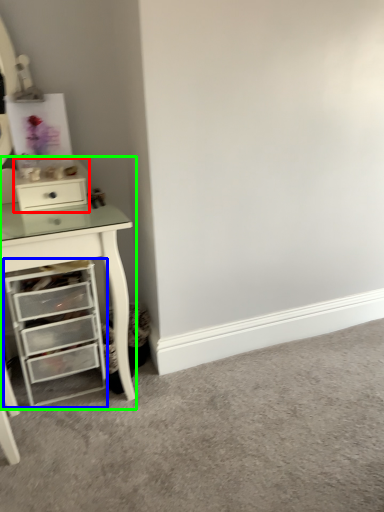
Question: Which is nearer to the file cabinet (highlighted by a red box)? chest of drawers (highlighted by a blue box) or computer desk (highlighted by a green box).

Choices:
 (A) chest of drawers
 (B) computer desk

Answer: (B)